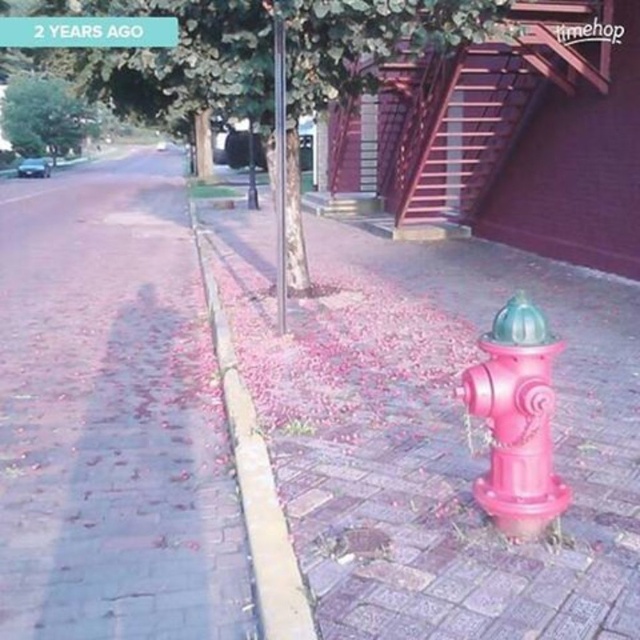
Does green leafy tree at upper left come in front of green plastic sign at upper left?

No, it is behind green plastic sign at upper left.

What do you see at coordinates (44, 116) in the screenshot? I see `green leafy tree at upper left` at bounding box center [44, 116].

I want to click on green leafy tree at upper left, so click(x=44, y=116).

The image size is (640, 640). What are the coordinates of `green leafy tree at center` in the screenshot? It's located at (269, 49).

Can you confirm if green leafy tree at center is positioned to the right of green leafy tree at upper left?

Indeed, green leafy tree at center is positioned on the right side of green leafy tree at upper left.

What do you see at coordinates (269, 49) in the screenshot?
I see `green leafy tree at center` at bounding box center [269, 49].

Find the location of a particular element. The image size is (640, 640). green leafy tree at center is located at coordinates click(x=269, y=49).

Image resolution: width=640 pixels, height=640 pixels. In order to click on pink matte hydrant at lower right in this screenshot , I will do `click(516, 419)`.

Between point (508, 349) and point (19, 93), which one is positioned behind?

Positioned behind is point (19, 93).

Measure the distance between pink matte hydrant at lower right and camera.

The distance of pink matte hydrant at lower right from camera is 2.46 meters.

This screenshot has width=640, height=640. What are the coordinates of `pink matte hydrant at lower right` in the screenshot? It's located at (516, 419).